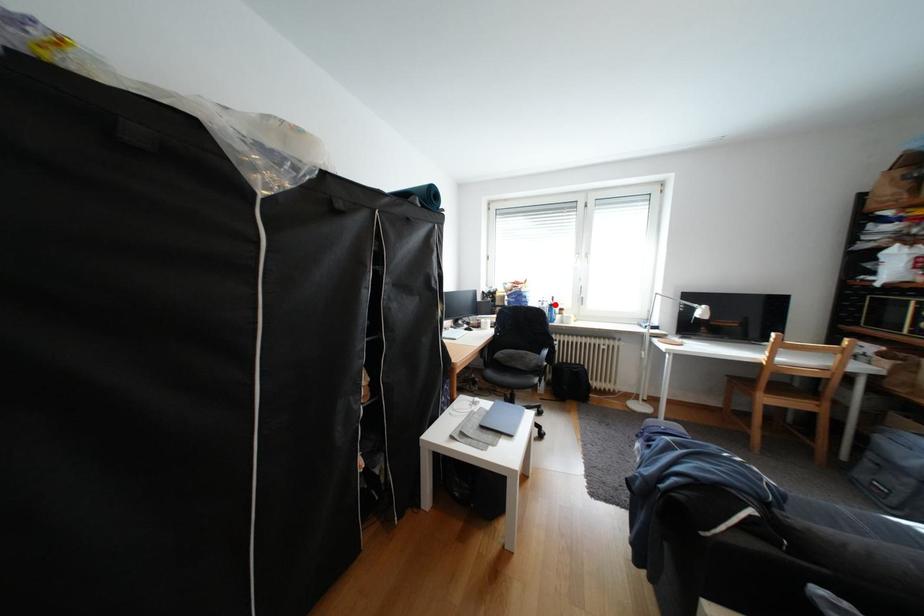
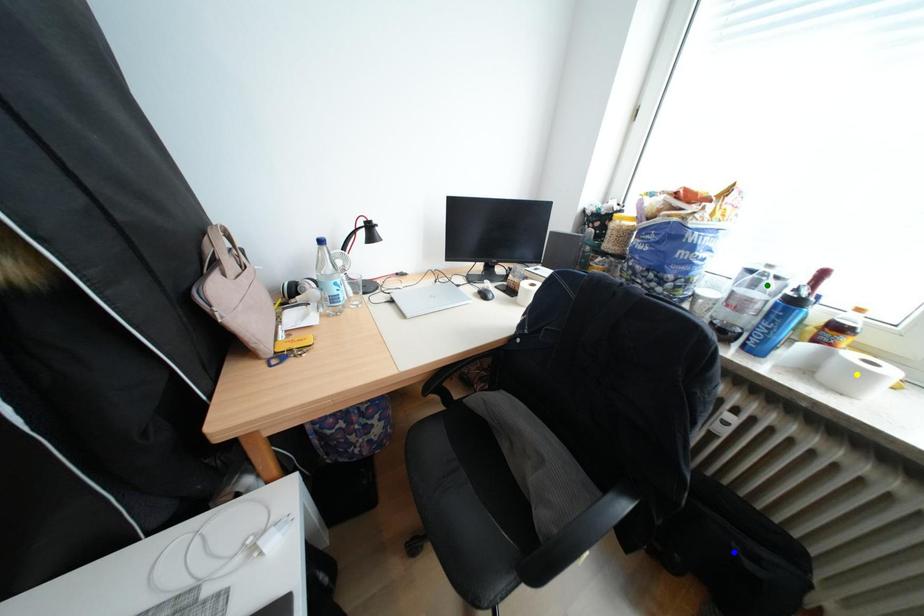
Question: I am providing you with two images of the same scene from different viewpoints. A red point is marked on the first image. You are given multiple points on the second image. Which point in image 2 is actually the same real-world point as the red point in image 1?

Choices:
 (A) blue point
 (B) yellow point
 (C) green point

Answer: (C)